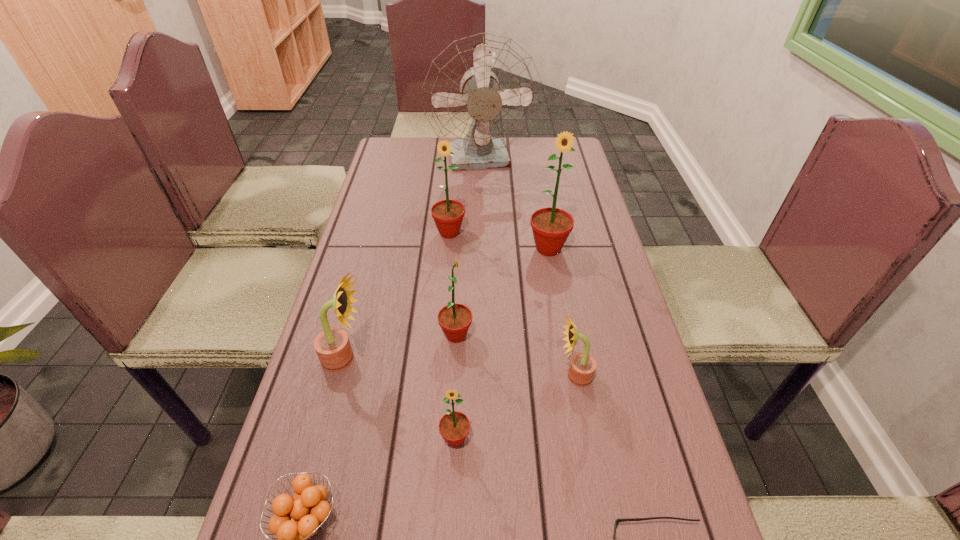
This screenshot has width=960, height=540. Find the location of `the tallest object`. the tallest object is located at coordinates (482, 92).

What are the coordinates of `the farthest object` in the screenshot? It's located at (482, 92).

You are a GUI agent. You are given a task and a screenshot of the screen. Output one action in this format:
    pyautogui.click(x=<x>, y=<y>)
    Task: Click on the biggest green sunflower
    Image resolution: width=960 pixels, height=540 pixels.
    Given the screenshot: What is the action you would take?
    pyautogui.click(x=551, y=226)

You are a GUI agent. You are given a task and a screenshot of the screen. Output one action in this format:
    pyautogui.click(x=<x>, y=<y>)
    Task: Click on the tallest sunflower
    Image resolution: width=960 pixels, height=540 pixels.
    Given the screenshot: What is the action you would take?
    pyautogui.click(x=551, y=226)

Where is `the third smallest green sunflower`? The image size is (960, 540). the third smallest green sunflower is located at coordinates (448, 215).

What are the coordinates of `the fifth shortest sunflower` in the screenshot? It's located at (448, 215).

At what (x,y) coordinates should I click in order to perform the action: click on the bigger yellow sunflower. Please return your answer as a coordinate pair (x, y). Image resolution: width=960 pixels, height=540 pixels. Looking at the image, I should click on pos(332,345).

Locate an element on the screen. The height and width of the screenshot is (540, 960). the leftmost sunflower is located at coordinates (332, 345).

Locate an element on the screen. The image size is (960, 540). the second nearest green sunflower is located at coordinates (454, 319).

The image size is (960, 540). In order to click on the smaller yellow sunflower in this screenshot , I will do `click(582, 367)`.